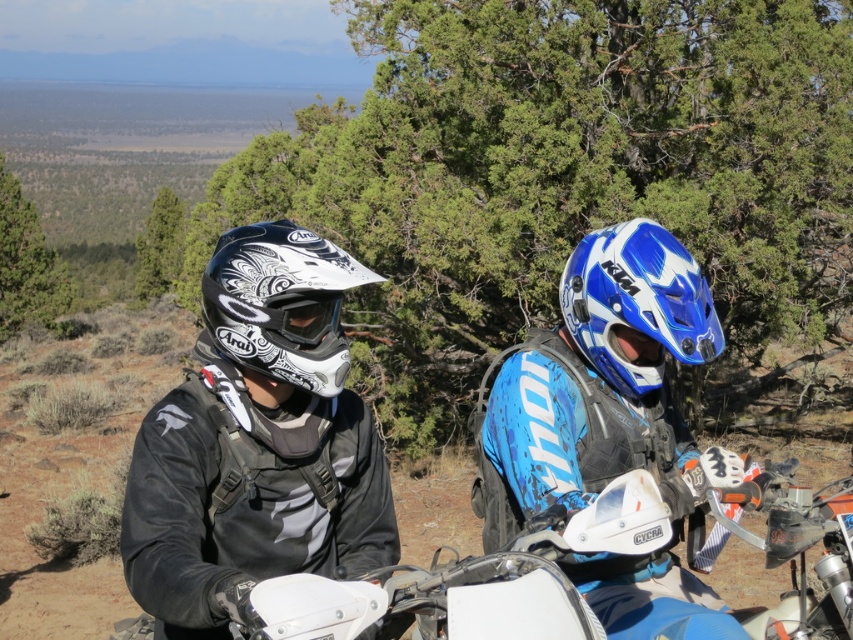
Looking at this image, you are a photographer trying to capture a clear shot of the white matte motorcycle at center and the matte white plastic goggles at center. Since both are white, you want to ensure you can distinguish them in the photo. According to the scene description, which object is positioned farther back, making it easier to separate them in the image?

The matte white plastic goggles at center is behind the white matte motorcycle at center, so it is positioned farther back. This creates a natural separation between the two white objects in the photo.

You are a safety inspector checking the equipment of two dirt bike riders. You notice the white matte helmet at center and the matte white plastic goggles at center. Which piece of equipment is bigger?

The white matte helmet at center is larger in size than the matte white plastic goggles at center.